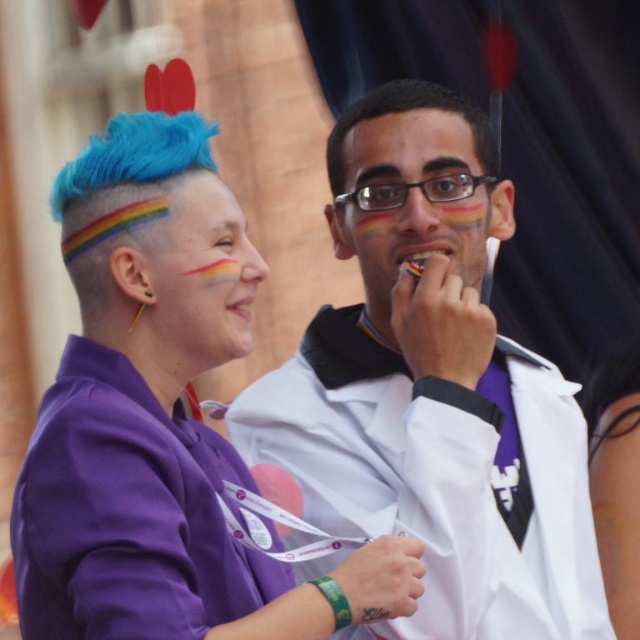
Question: Which point is farther from the camera taking this photo?

Choices:
 (A) (376, 188)
 (B) (214, 289)
 (C) (609, 582)
 (D) (88, 365)

Answer: (A)

Question: Which point is closer to the camera?

Choices:
 (A) (435, 305)
 (B) (492, 240)
 (C) (208, 193)

Answer: (C)

Question: Can you confirm if purple fabric shirt at left is positioned above matte skin at center?

Choices:
 (A) yes
 (B) no

Answer: (B)

Question: Can you confirm if white matte lab coat at center is smaller than rainbow painted face at center?

Choices:
 (A) no
 (B) yes

Answer: (A)

Question: Is purple matte shirt at left positioned in front of matte skin at center?

Choices:
 (A) yes
 (B) no

Answer: (A)

Question: Which point is farther from the camera taking this photo?

Choices:
 (A) (596, 458)
 (B) (493, 118)
 (C) (188, 428)

Answer: (B)